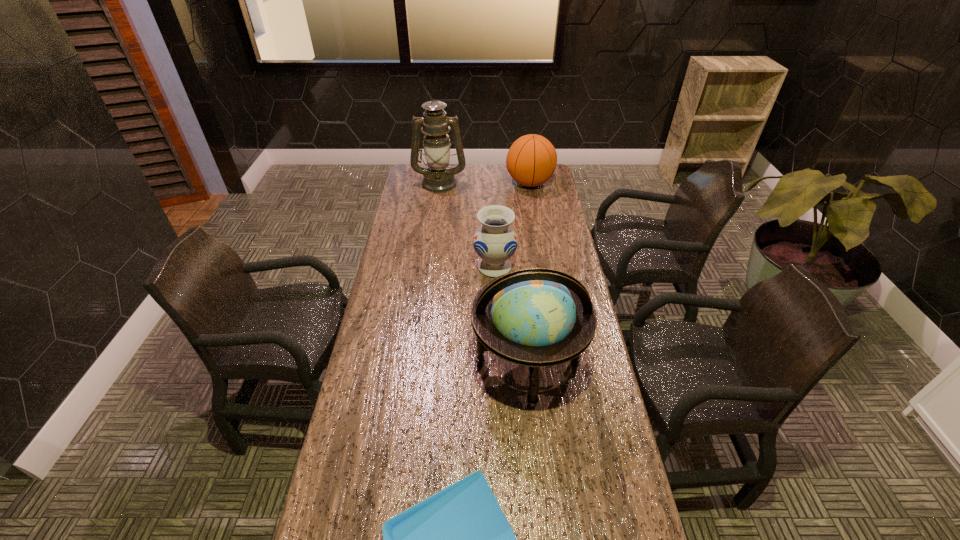
Where is `object that is positioned at the left edge`? The image size is (960, 540). object that is positioned at the left edge is located at coordinates 438,178.

Image resolution: width=960 pixels, height=540 pixels. I want to click on globe located in the right edge section of the desktop, so pos(538,317).

The height and width of the screenshot is (540, 960). I want to click on basketball at the right edge, so click(531, 160).

The height and width of the screenshot is (540, 960). Identify the location of object that is at the far left corner. (438, 178).

Locate an element on the screen. The width and height of the screenshot is (960, 540). object located at the far right corner is located at coordinates (531, 160).

This screenshot has width=960, height=540. I want to click on free space at the far edge of the desktop, so click(x=481, y=177).

Locate an element on the screen. vacant region at the left edge of the desktop is located at coordinates [371, 424].

In the image, there is a desktop. What are the coordinates of `vacant space at the right edge` in the screenshot? It's located at (600, 485).

Where is `vacant space at the far right corner of the desktop`? This screenshot has width=960, height=540. vacant space at the far right corner of the desktop is located at coordinates (556, 187).

Locate an element on the screen. Image resolution: width=960 pixels, height=540 pixels. free space between the oil lamp and the third nearest object is located at coordinates (468, 225).